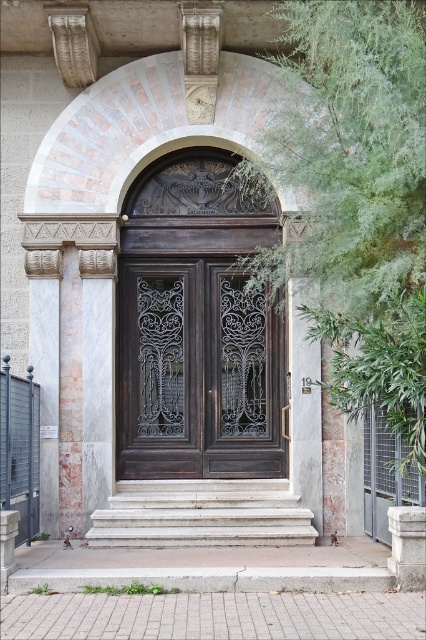
Is dark wood door at center wider than white marble column at left?

Indeed, dark wood door at center has a greater width compared to white marble column at left.

Which is in front, point (239, 438) or point (71, 310)?

Positioned in front is point (71, 310).

This screenshot has height=640, width=426. Identify the location of dark wood door at center. (196, 372).

Is white marble stairs at center positioned at the back of white marble column at left?

No, it is in front of white marble column at left.

Is point (305, 534) more distant than point (75, 289)?

No.

Locate an element on the screen. white marble stairs at center is located at coordinates pos(201,515).

Can you confirm if dark wood door at center is taller than white marble stairs at center?

Correct, dark wood door at center is much taller as white marble stairs at center.

Which is behind, point (259, 410) or point (281, 513)?

The point (259, 410) is behind.

The image size is (426, 640). What do you see at coordinates (196, 372) in the screenshot?
I see `dark wood door at center` at bounding box center [196, 372].

Identify the location of dark wood door at center. This screenshot has height=640, width=426. (196, 372).